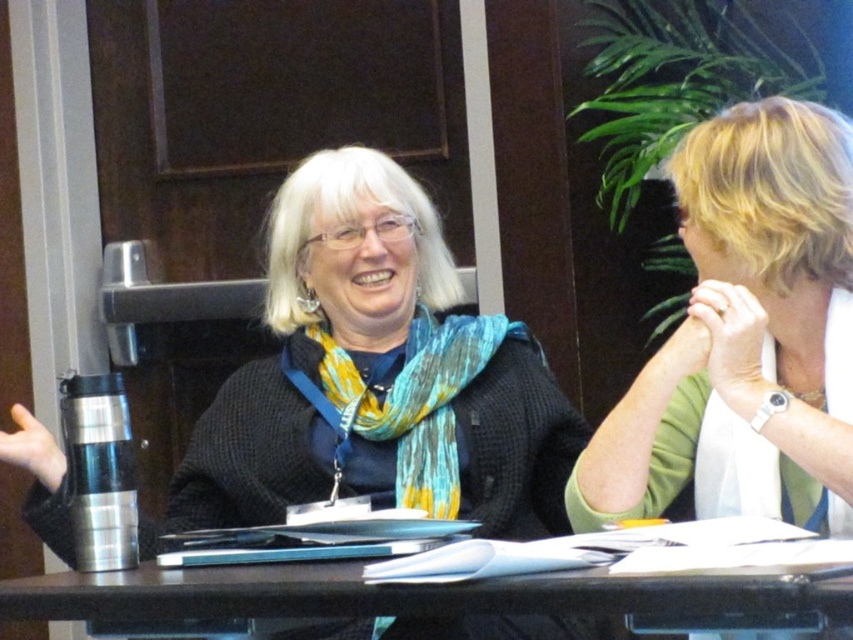
You are an interior designer looking at this image. You need to determine the spatial relationship between the white fabric at upper right and the blue and yellow woven scarf at center. Which one is positioned higher in the image?

The white fabric at upper right is positioned higher than the blue and yellow woven scarf at center because it is located above it.

You are standing in front of the black plastic table at center and the blue and yellow woven scarf at center. Which object is positioned higher from the ground?

The blue and yellow woven scarf at center is positioned higher from the ground than the black plastic table at center because the table is located below the scarf.